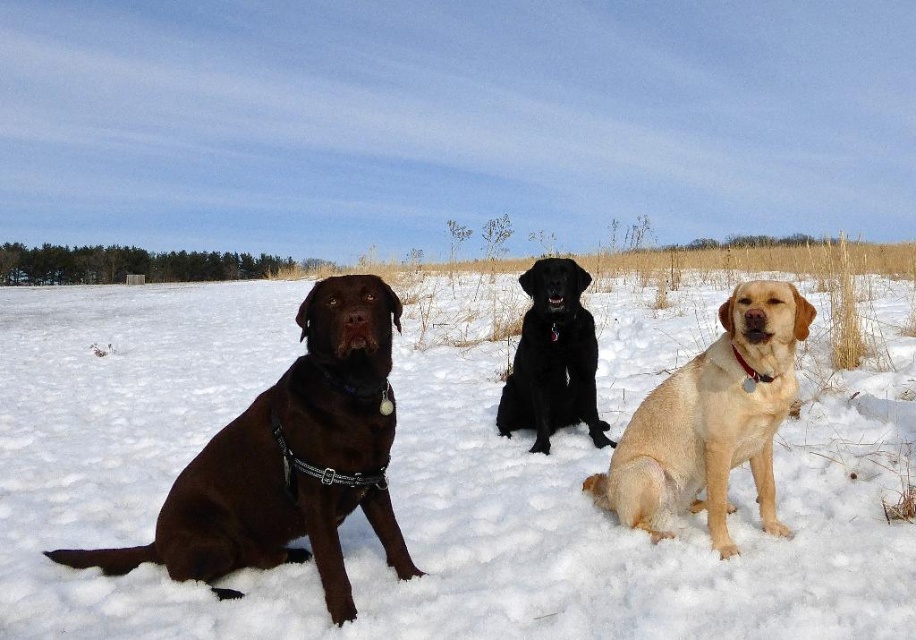
Is white fluffy snow at center above golden fur dog at center?

Indeed, white fluffy snow at center is positioned over golden fur dog at center.

The height and width of the screenshot is (640, 916). In order to click on white fluffy snow at center in this screenshot , I will do `click(424, 490)`.

You are a GUI agent. You are given a task and a screenshot of the screen. Output one action in this format:
    pyautogui.click(x=<x>, y=<y>)
    Task: Click on the white fluffy snow at center
    Image resolution: width=916 pixels, height=640 pixels.
    Given the screenshot: What is the action you would take?
    pyautogui.click(x=424, y=490)

Between point (213, 499) and point (761, 314), which one is positioned in front?

Point (761, 314)

Does point (124, 563) lie behind point (738, 378)?

Yes.

Between point (311, 536) and point (612, 508), which one is positioned in front?

Point (311, 536)

This screenshot has width=916, height=640. In order to click on shiny brown dog at left in this screenshot , I will do `click(290, 460)`.

Does shiny brown dog at left appear on the right side of black glossy dog at center?

No, shiny brown dog at left is not to the right of black glossy dog at center.

Which is more to the left, shiny brown dog at left or black glossy dog at center?

shiny brown dog at left

Locate an element on the screen. This screenshot has height=640, width=916. shiny brown dog at left is located at coordinates (290, 460).